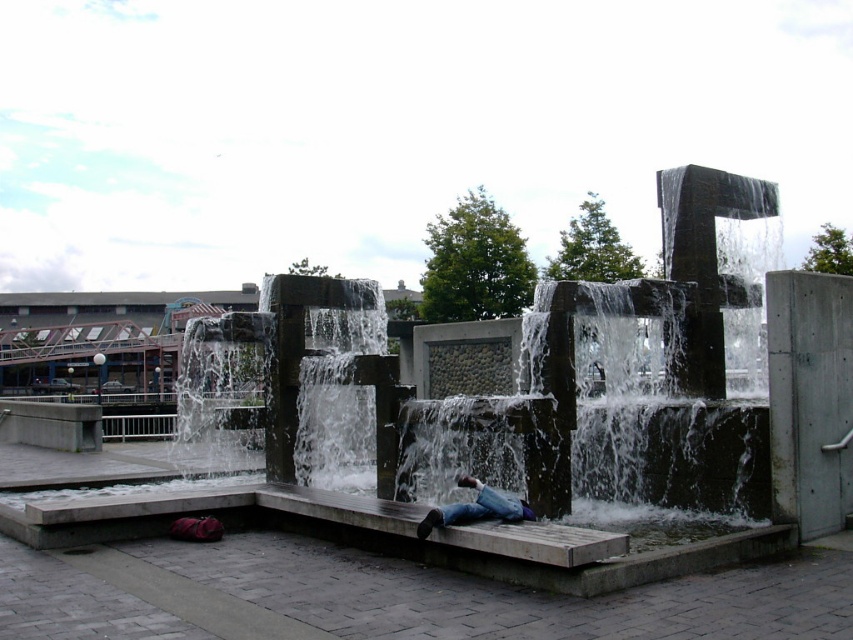
Question: Which point appears closest to the camera in this image?

Choices:
 (A) (479, 513)
 (B) (631, 561)

Answer: (B)

Question: Is concrete water at center below blue jeans at center?

Choices:
 (A) no
 (B) yes

Answer: (A)

Question: In this image, where is concrete water at center located relative to blue jeans at center?

Choices:
 (A) right
 (B) left

Answer: (B)

Question: Does concrete water at center appear under blue jeans at center?

Choices:
 (A) no
 (B) yes

Answer: (A)

Question: Which point is closer to the camera?

Choices:
 (A) (378, 454)
 (B) (518, 500)

Answer: (B)